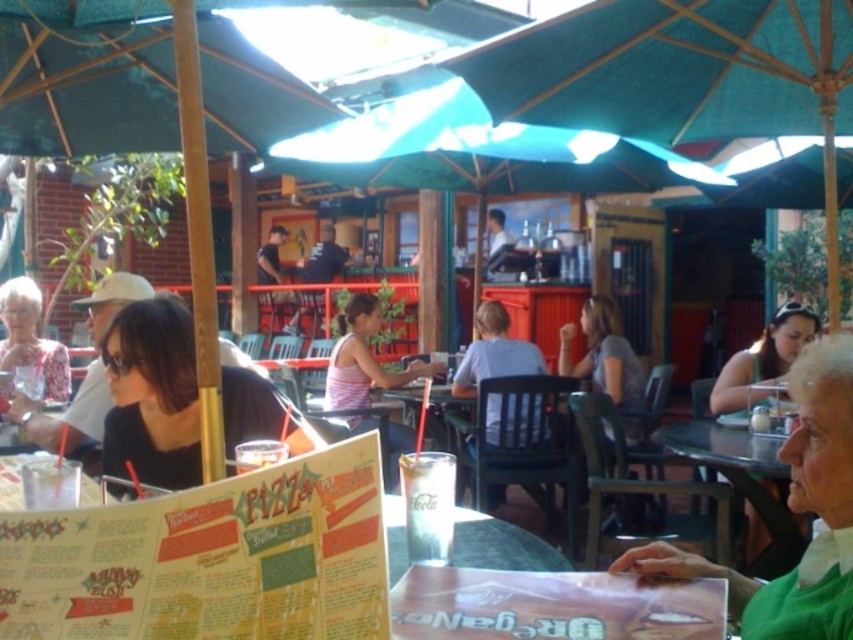
Question: Which point is farther to the camera?

Choices:
 (A) black matte shirt at left
 (B) black plastic table at center
 (C) matte black sunglasses at right

Answer: (C)

Question: Does transparent plastic menu at center have a greater width compared to matte black shirt at left?

Choices:
 (A) yes
 (B) no

Answer: (B)

Question: Is matte black hair at right above matte black shirt at center?

Choices:
 (A) yes
 (B) no

Answer: (B)

Question: Is black matte shirt at left below matte black hair at right?

Choices:
 (A) yes
 (B) no

Answer: (A)

Question: Which is farther from the black plastic table at center?

Choices:
 (A) green fabric shirt at lower right
 (B) teal fabric umbrella at center
 (C) gray fabric shirt at center
 (D) transparent plastic menu at center

Answer: (D)

Question: Which is farther from the transparent plastic menu at center?

Choices:
 (A) black plastic table at center
 (B) light blue shirt at center

Answer: (B)